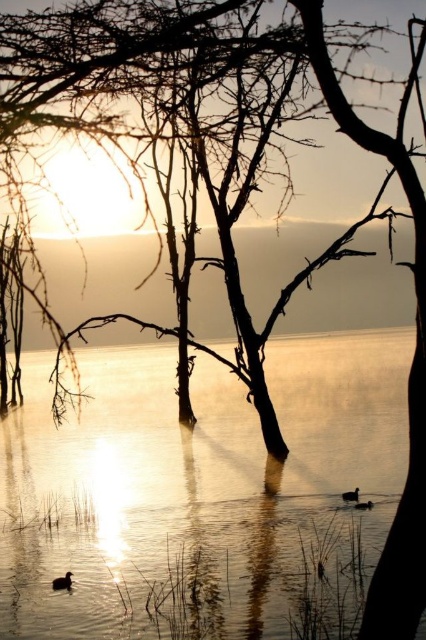
Between point (63, 580) and point (350, 493), which one is positioned behind?

The point (350, 493) is more distant.

Does brown matte duck at lower left have a greater width compared to dark brown feathered duck at center?

No.

Image resolution: width=426 pixels, height=640 pixels. What are the coordinates of `brown matte duck at lower left` in the screenshot? It's located at (63, 580).

You are a GUI agent. You are given a task and a screenshot of the screen. Output one action in this format:
    pyautogui.click(x=<x>, y=<y>)
    Task: Click on the brown matte duck at lower left
    
    Given the screenshot: What is the action you would take?
    pyautogui.click(x=63, y=580)

Which is more to the right, silvery reflective water at center or brown matte duck at lower center?

From the viewer's perspective, brown matte duck at lower center appears more on the right side.

Which of these two, silvery reflective water at center or brown matte duck at lower center, stands taller?

silvery reflective water at center is taller.

Is point (235, 449) closer to camera compared to point (371, 506)?

No, it is behind (371, 506).

The width and height of the screenshot is (426, 640). Identify the location of silvery reflective water at center. (193, 480).

Does silvery reflective water at center lie behind brown matte duck at lower left?

No.

Who is taller, silvery reflective water at center or brown matte duck at lower left?

silvery reflective water at center is taller.

Locate an element on the screen. Image resolution: width=426 pixels, height=640 pixels. silvery reflective water at center is located at coordinates click(x=193, y=480).